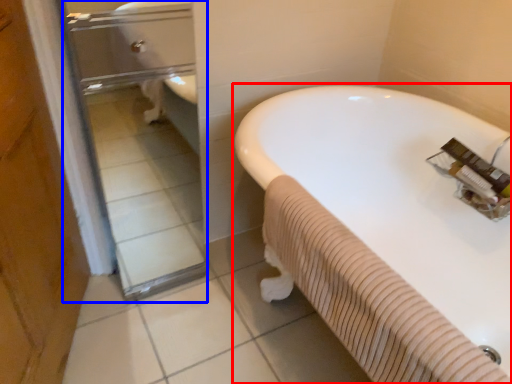
Question: Among these objects, which one is farthest to the camera, bathtub (highlighted by a red box) or glass door (highlighted by a blue box)?

Choices:
 (A) bathtub
 (B) glass door

Answer: (B)